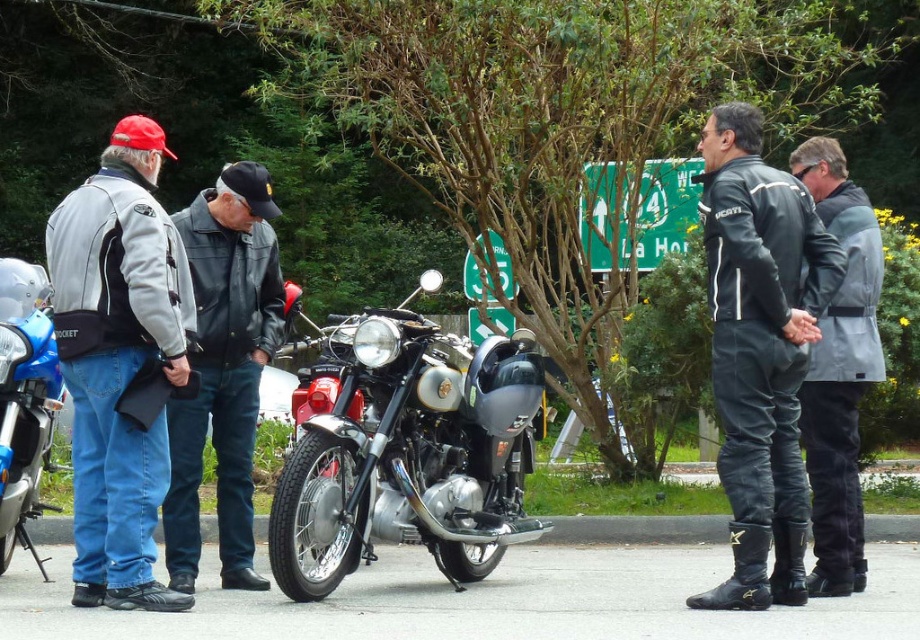
Which is below, gray fabric jacket at center or shiny blue motorcycle at left?

shiny blue motorcycle at left

Which is above, gray fabric jacket at center or shiny blue motorcycle at left?

gray fabric jacket at center is above.

Where is `gray fabric jacket at center`? This screenshot has width=920, height=640. gray fabric jacket at center is located at coordinates (838, 371).

Measure the distance between black leather jacket at right and camera.

A distance of 25.91 feet exists between black leather jacket at right and camera.

I want to click on black leather jacket at right, so click(760, 349).

Is matte black jacket at left taller than black leather jacket at left?

Yes.

What do you see at coordinates (118, 362) in the screenshot? I see `matte black jacket at left` at bounding box center [118, 362].

Find the location of a particular element. matte black jacket at left is located at coordinates (118, 362).

The image size is (920, 640). Find the location of `matte black jacket at left`. matte black jacket at left is located at coordinates (118, 362).